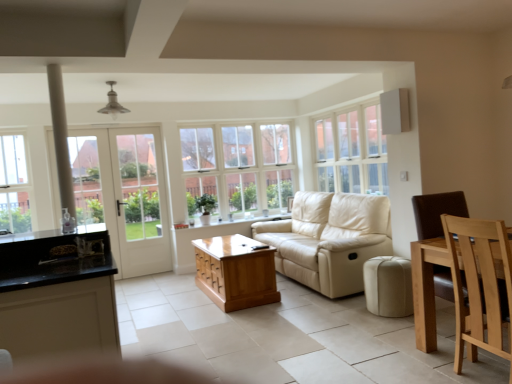
Measure the distance between point (381,297) and camera.

Point (381,297) and camera are 4.26 meters apart.

How much space does clear glass window at left, acting as the third window starting from the right, occupy horizontally?

clear glass window at left, acting as the third window starting from the right, is 9.96 centimeters in width.

The height and width of the screenshot is (384, 512). In order to click on clear glass window at left, arranged as the first window when viewed from the left in this screenshot , I will do `click(14, 185)`.

Locate an element on the screen. The height and width of the screenshot is (384, 512). wooden coffee table at center is located at coordinates (234, 272).

Measure the distance between point (279, 201) and camera.

7.03 meters.

Image resolution: width=512 pixels, height=384 pixels. Find the location of `white glass door at left`. white glass door at left is located at coordinates (140, 201).

In order to click on studio couch in front of the clear glass window at center, positioned as the 2th window in left-to-right order in this screenshot , I will do `click(329, 239)`.

Is cream leather studio couch at center a part of clear glass window at center, the second window from the right?

Actually, cream leather studio couch at center is outside clear glass window at center, the second window from the right.

Is clear glass window at center, the second window from the right, wider or thinner than cream leather studio couch at center?

Considering their sizes, clear glass window at center, the second window from the right, looks slimmer than cream leather studio couch at center.

From a real-world perspective, between clear glass window at left, arranged as the first window when viewed from the left, and beige leather ottoman at lower center, who is vertically higher?

In real-world perspective, clear glass window at left, arranged as the first window when viewed from the left, is above.

Is clear glass window at left, arranged as the first window when viewed from the left, behind beige leather ottoman at lower center?

Yes, the depth of clear glass window at left, arranged as the first window when viewed from the left, is greater than that of beige leather ottoman at lower center.

Based on the photo, based on their sizes in the image, would you say clear glass window at left, arranged as the first window when viewed from the left, is bigger or smaller than beige leather ottoman at lower center?

clear glass window at left, arranged as the first window when viewed from the left, is smaller than beige leather ottoman at lower center.

Is clear glass window at left, arranged as the first window when viewed from the left, oriented away from beige leather ottoman at lower center?

clear glass window at left, arranged as the first window when viewed from the left, does not have its back to beige leather ottoman at lower center.

From the image's perspective, between wooden coffee table at center and beige leather ottoman at lower center, who is located below?

wooden coffee table at center appears lower in the image.

Which of these two, wooden coffee table at center or beige leather ottoman at lower center, stands taller?

wooden coffee table at center is taller.

From a real-world perspective, is white wood window at upper center, the 1th window in the right-to-left sequence, below clear glass window at center, the second window from the right?

No, from a real-world perspective, white wood window at upper center, the 1th window in the right-to-left sequence, is not beneath clear glass window at center, the second window from the right.

Image resolution: width=512 pixels, height=384 pixels. Identify the location of window that appears on the right of clear glass window at center, positioned as the 2th window in left-to-right order. (352, 152).

From the image's perspective, relative to clear glass window at center, the second window from the right, is white wood window at upper center, which is the third window in left-to-right order, above or below?

Clearly, from the image's perspective, white wood window at upper center, which is the third window in left-to-right order, is above clear glass window at center, the second window from the right.

Consider the image. Is white wood window at upper center, which is the third window in left-to-right order, in front of or behind clear glass window at center, the second window from the right, in the image?

Visually, white wood window at upper center, which is the third window in left-to-right order, is located in front of clear glass window at center, the second window from the right.

Considering the relative sizes of clear glass window at center, positioned as the 2th window in left-to-right order, and wooden coffee table at center in the image provided, is clear glass window at center, positioned as the 2th window in left-to-right order, wider than wooden coffee table at center?

No.

From a real-world perspective, is clear glass window at center, the second window from the right, above or below wooden coffee table at center?

clear glass window at center, the second window from the right, is above wooden coffee table at center.

How different are the orientations of clear glass window at center, positioned as the 2th window in left-to-right order, and wooden coffee table at center in degrees?

There is a 89.7-degree angle between the facing directions of clear glass window at center, positioned as the 2th window in left-to-right order, and wooden coffee table at center.

Is clear glass window at center, positioned as the 2th window in left-to-right order, touching wooden coffee table at center?

clear glass window at center, positioned as the 2th window in left-to-right order, is not next to wooden coffee table at center, and they're not touching.

Where is `the 3rd window positioned above the beige leather ottoman at lower center (from the image's perspective)`? This screenshot has height=384, width=512. the 3rd window positioned above the beige leather ottoman at lower center (from the image's perspective) is located at coordinates 352,152.

Looking at this image, from the image's perspective, would you say white wood window at upper center, the 1th window in the right-to-left sequence, is shown under beige leather ottoman at lower center?

Actually, white wood window at upper center, the 1th window in the right-to-left sequence, appears above beige leather ottoman at lower center in the image.

Considering the sizes of objects white wood window at upper center, which is the third window in left-to-right order, and beige leather ottoman at lower center in the image provided, who is wider, white wood window at upper center, which is the third window in left-to-right order, or beige leather ottoman at lower center?

With larger width is beige leather ottoman at lower center.

From a real-world perspective, which is physically above, white wood window at upper center, the 1th window in the right-to-left sequence, or beige leather ottoman at lower center?

white wood window at upper center, the 1th window in the right-to-left sequence, from a real-world perspective.

Considering the relative sizes of cream leather studio couch at center and clear glass window at center, positioned as the 2th window in left-to-right order, in the image provided, is cream leather studio couch at center shorter than clear glass window at center, positioned as the 2th window in left-to-right order,?

Correct, cream leather studio couch at center is not as tall as clear glass window at center, positioned as the 2th window in left-to-right order.

Consider the image. Which point is more distant from viewer, (350,216) or (198,171)?

Positioned behind is point (198,171).

How many degrees apart are the facing directions of cream leather studio couch at center and clear glass window at center, positioned as the 2th window in left-to-right order?

The angular difference between cream leather studio couch at center and clear glass window at center, positioned as the 2th window in left-to-right order, is 89.5 degrees.

From a real-world perspective, is cream leather studio couch at center over clear glass window at center, positioned as the 2th window in left-to-right order?

No, from a real-world perspective, cream leather studio couch at center is not above clear glass window at center, positioned as the 2th window in left-to-right order.

Where is `studio couch that appears on the right of clear glass window at center, positioned as the 2th window in left-to-right order`? This screenshot has height=384, width=512. studio couch that appears on the right of clear glass window at center, positioned as the 2th window in left-to-right order is located at coordinates (329, 239).

I want to click on stool in front of the clear glass window at left, acting as the third window starting from the right, so click(388, 286).

When comparing their distances from wooden coffee table at center, does brown wooden chair at right or white wood window at upper center, which is the third window in left-to-right order, seem further?

Based on the image, brown wooden chair at right appears to be further to wooden coffee table at center.

Looking at this image, which object lies nearer to the anchor point brown wooden chair at right, cream leather studio couch at center or clear glass window at left, arranged as the first window when viewed from the left?

Among the two, cream leather studio couch at center is located nearer to brown wooden chair at right.

Estimate the real-world distances between objects in this image. Which object is closer to white wood window at upper center, the 1th window in the right-to-left sequence, clear glass window at left, acting as the third window starting from the right, or wooden coffee table at center?

Based on the image, wooden coffee table at center appears to be nearer to white wood window at upper center, the 1th window in the right-to-left sequence.

Which object lies nearer to the anchor point brown wooden chair at right, white wood window at upper center, which is the third window in left-to-right order, or white glass door at left?

white wood window at upper center, which is the third window in left-to-right order, is positioned closer to the anchor brown wooden chair at right.

Estimate the real-world distances between objects in this image. Which object is closer to cream leather studio couch at center, clear glass window at center, positioned as the 2th window in left-to-right order, or beige leather ottoman at lower center?

beige leather ottoman at lower center is positioned closer to the anchor cream leather studio couch at center.

Estimate the real-world distances between objects in this image. Which object is further from brown wooden chair at right, white wood window at upper center, which is the third window in left-to-right order, or beige leather ottoman at lower center?

white wood window at upper center, which is the third window in left-to-right order, is further to brown wooden chair at right.

Which object lies further to the anchor point wooden coffee table at center, brown wooden chair at right or cream leather studio couch at center?

brown wooden chair at right.

When comparing their distances from white wood window at upper center, which is the third window in left-to-right order, does white glass door at left or clear glass window at center, positioned as the 2th window in left-to-right order, seem closer?

clear glass window at center, positioned as the 2th window in left-to-right order.

Find the location of `studio couch between brown wooden chair at right and clear glass window at center, the second window from the right, in the front-back direction`. studio couch between brown wooden chair at right and clear glass window at center, the second window from the right, in the front-back direction is located at coordinates (329, 239).

You are a GUI agent. You are given a task and a screenshot of the screen. Output one action in this format:
    pyautogui.click(x=<x>, y=<y>)
    Task: Click on the stool located between wooden coffee table at center and brown wooden chair at right in the left-right direction
    This screenshot has height=384, width=512.
    Given the screenshot: What is the action you would take?
    pyautogui.click(x=388, y=286)

Identify the location of studio couch between brown wooden chair at right and white wood window at upper center, the 1th window in the right-to-left sequence, in the front-back direction. (329, 239).

Find the location of a particular element. table between white glass door at left and brown wooden chair at right from left to right is located at coordinates (234, 272).